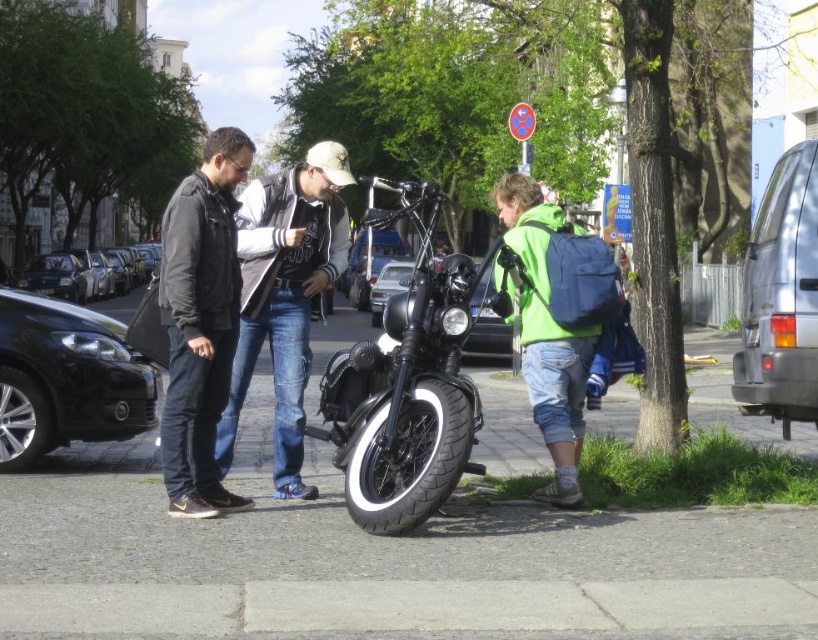
Between denim jeans at center and metallic silver van at right, which one has more height?

denim jeans at center

Consider the image. Does denim jeans at center appear on the right side of metallic silver van at right?

No, denim jeans at center is not to the right of metallic silver van at right.

This screenshot has height=640, width=818. Describe the element at coordinates (285, 296) in the screenshot. I see `denim jeans at center` at that location.

You are a GUI agent. You are given a task and a screenshot of the screen. Output one action in this format:
    pyautogui.click(x=<x>, y=<y>)
    Task: Click on the denim jeans at center
    The width and height of the screenshot is (818, 640).
    Given the screenshot: What is the action you would take?
    pyautogui.click(x=285, y=296)

Locate an element on the screen. gray concrete pavement at lower center is located at coordinates pyautogui.click(x=390, y=568).

Which of these two, gray concrete pavement at lower center or black matte motorcycle at center, stands taller?

black matte motorcycle at center is taller.

Does point (254, 572) lie in front of point (405, 435)?

Yes, point (254, 572) is closer to viewer.

Locate an element on the screen. Image resolution: width=818 pixels, height=640 pixels. gray concrete pavement at lower center is located at coordinates (390, 568).

Can you confirm if gray concrete pavement at lower center is positioned below shiny black sedan at left?

Correct, gray concrete pavement at lower center is located below shiny black sedan at left.

Which is more to the left, gray concrete pavement at lower center or shiny black sedan at left?

Positioned to the left is shiny black sedan at left.

Is point (736, 618) behind point (65, 442)?

No, (736, 618) is in front of (65, 442).

Find the location of a particular element. The height and width of the screenshot is (640, 818). gray concrete pavement at lower center is located at coordinates (390, 568).